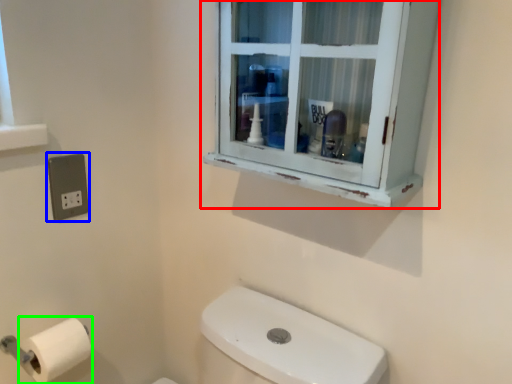
Question: Based on their relative distances, which object is farther from window (highlighted by a red box)? Choose from electric outlet (highlighted by a blue box) and toilet paper (highlighted by a green box).

Choices:
 (A) electric outlet
 (B) toilet paper

Answer: (B)